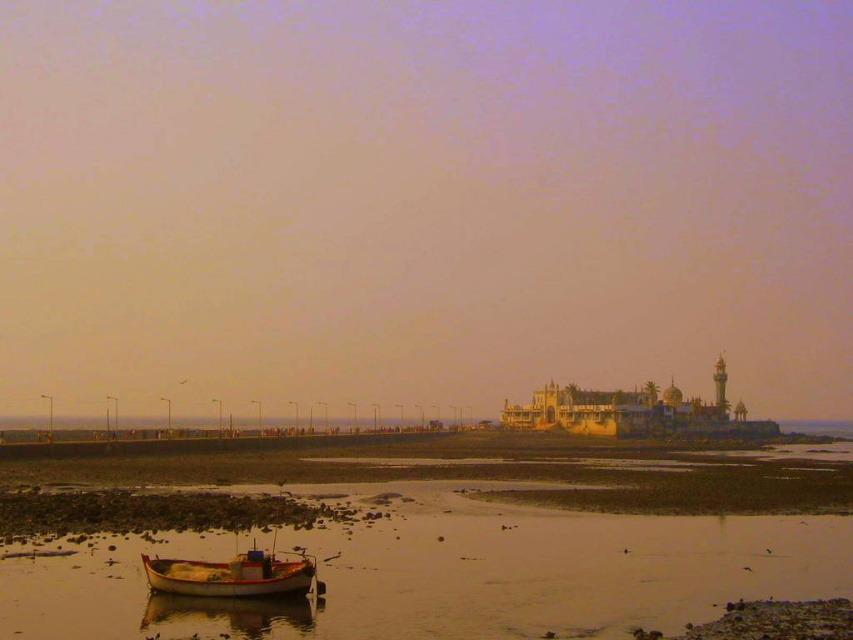
You are standing at the center of the image and want to walk to the smooth sand beach at lower left. In which direction should you move relative to your current position?

You should move towards the lower left direction to reach the smooth sand beach at lower left since its 2D location is at point (440, 572).